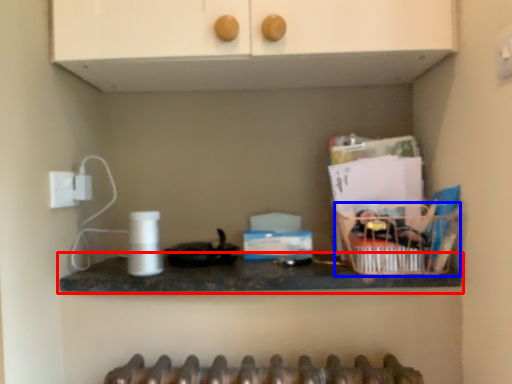
Question: Which object is closer to the camera taking this photo, countertop (highlighted by a red box) or basket (highlighted by a blue box)?

Choices:
 (A) countertop
 (B) basket

Answer: (A)